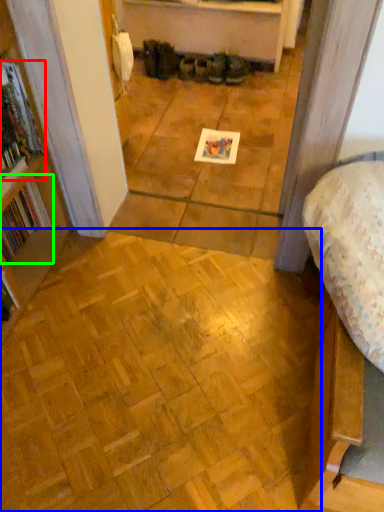
Question: Which is nearer to the book (highlighted by a red box)? plywood (highlighted by a blue box) or book (highlighted by a green box).

Choices:
 (A) plywood
 (B) book

Answer: (B)